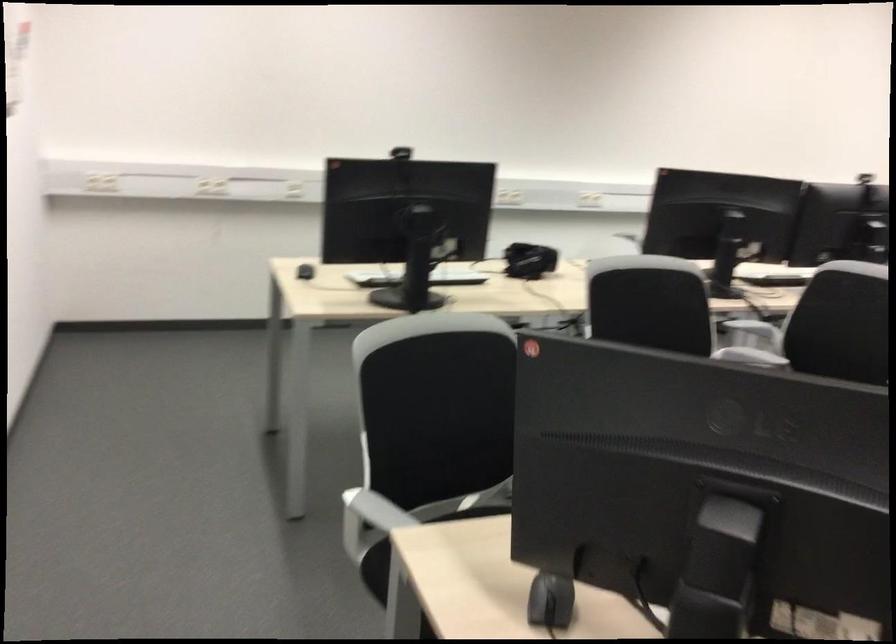
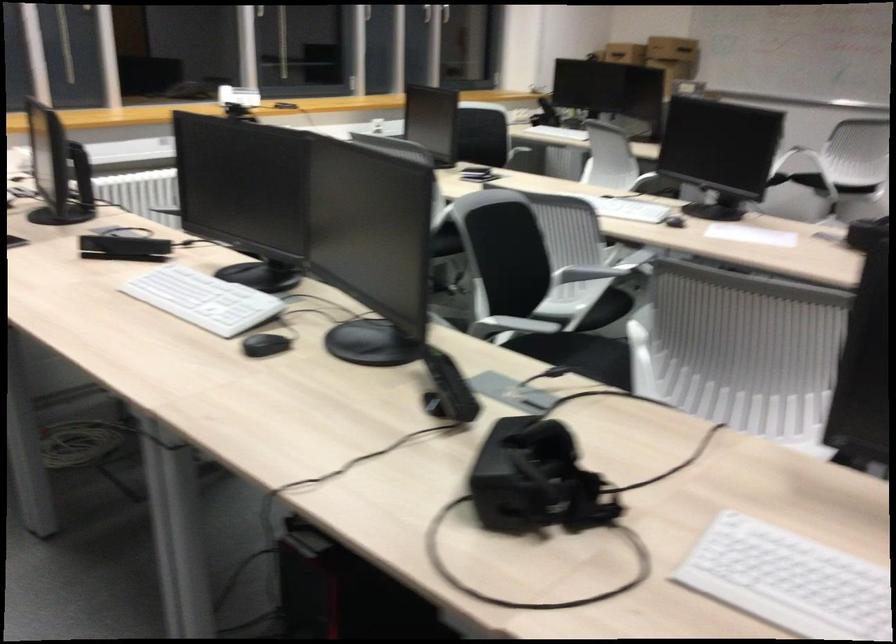
In the second image, find the point that corresponds to (640,266) in the first image.

(734, 277)